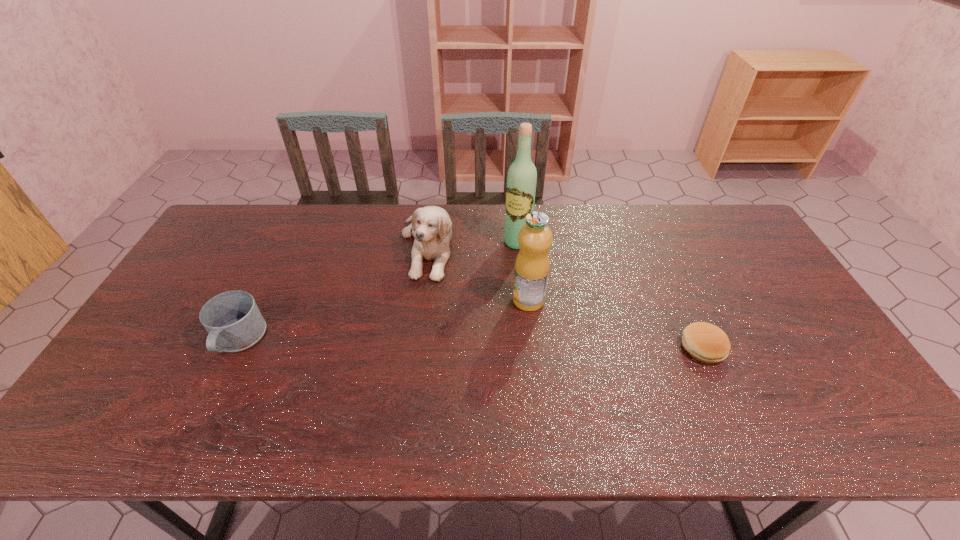
Find the location of a particular element. The image size is (960, 540). free space between the mug and the shortest object is located at coordinates (470, 344).

Identify the location of free spot between the second tallest object and the third tallest object. Image resolution: width=960 pixels, height=540 pixels. (478, 273).

Where is `free space between the leftmost object and the patty`? The image size is (960, 540). free space between the leftmost object and the patty is located at coordinates (470, 344).

Image resolution: width=960 pixels, height=540 pixels. What are the coordinates of `free space between the patty and the fourth tallest object` in the screenshot? It's located at 470,344.

Image resolution: width=960 pixels, height=540 pixels. What are the coordinates of `vacant region between the shortest object and the third tallest object` in the screenshot? It's located at (565, 296).

Identify the location of unoccupied position between the rightmost object and the second tallest object. (615, 324).

Where is `free space between the wine bottle and the shortest object`? This screenshot has height=540, width=960. free space between the wine bottle and the shortest object is located at coordinates (611, 295).

Identify which object is the nearest to the third shortest object. Please provide its 2D coordinates. Your answer should be formatted as a tuple, i.e. [(x, y)], where the tuple contains the x and y coordinates of a point satisfying the conditions above.

[(522, 176)]

The image size is (960, 540). Identify the location of object identified as the closest to the leftmost object. (431, 226).

Where is `vacant region that satisfies the following two spatial constraints: 1. on the side of the fourth tallest object with the handle; 2. on the right side of the shortest object`? The height and width of the screenshot is (540, 960). vacant region that satisfies the following two spatial constraints: 1. on the side of the fourth tallest object with the handle; 2. on the right side of the shortest object is located at coordinates (234, 348).